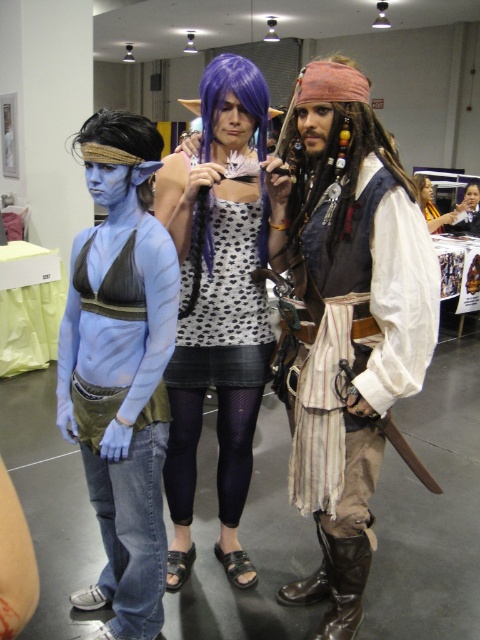
From the picture: Is polka dot fabric dress at center closer to the viewer compared to matte purple wig at center?

Yes, polka dot fabric dress at center is in front of matte purple wig at center.

Looking at this image, can you confirm if polka dot fabric dress at center is positioned to the right of matte purple wig at center?

Incorrect, polka dot fabric dress at center is not on the right side of matte purple wig at center.

Is point (197, 362) in front of point (463, 208)?

That is True.

The width and height of the screenshot is (480, 640). In order to click on polka dot fabric dress at center in this screenshot , I will do `click(217, 305)`.

This screenshot has height=640, width=480. Identify the location of purple synthetic wig at center. (236, 97).

Which is in front, point (193, 276) or point (475, 205)?

Point (193, 276) is in front.

Locate an element on the screen. Image resolution: width=480 pixels, height=640 pixels. purple synthetic wig at center is located at coordinates (236, 97).

Is point (372, 451) closer to camera compared to point (427, 180)?

Yes, it is in front of point (427, 180).

Which is more to the right, leather vest at center or matte black dress at center?

Positioned to the right is matte black dress at center.

Does point (398, 209) come in front of point (425, 180)?

That is True.

Locate an element on the screen. leather vest at center is located at coordinates (348, 321).